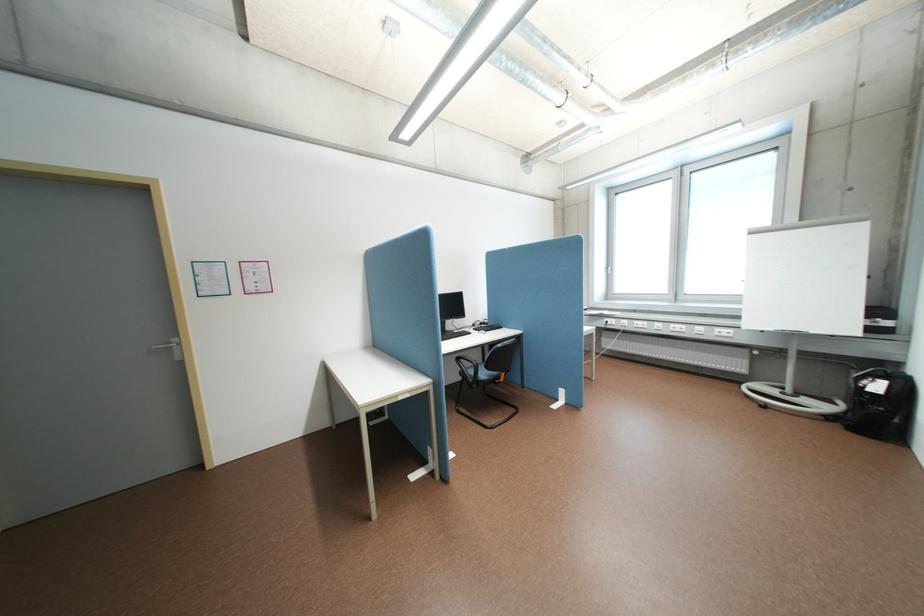
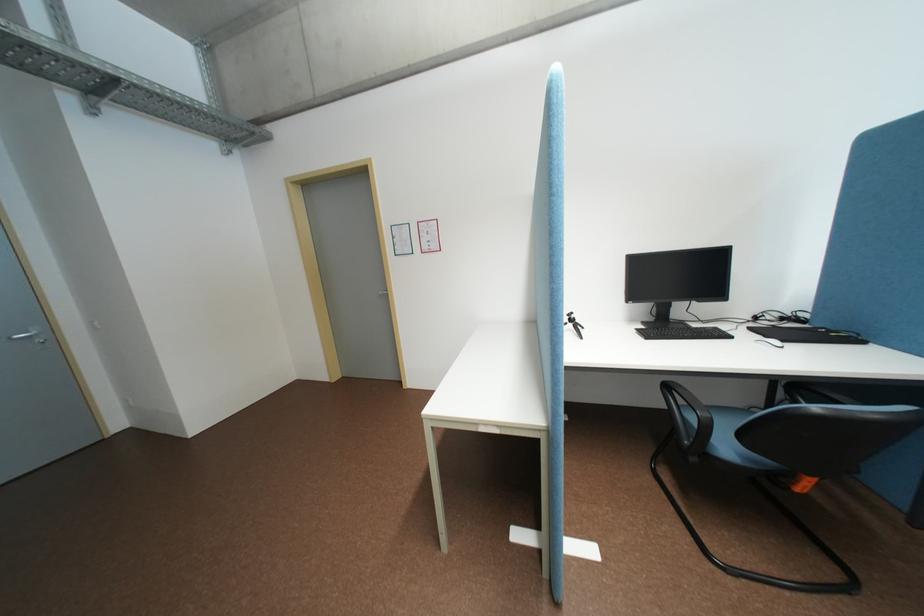
Question: How did the camera likely rotate?

Choices:
 (A) Left
 (B) Right
 (C) Up
 (D) Down

Answer: (A)